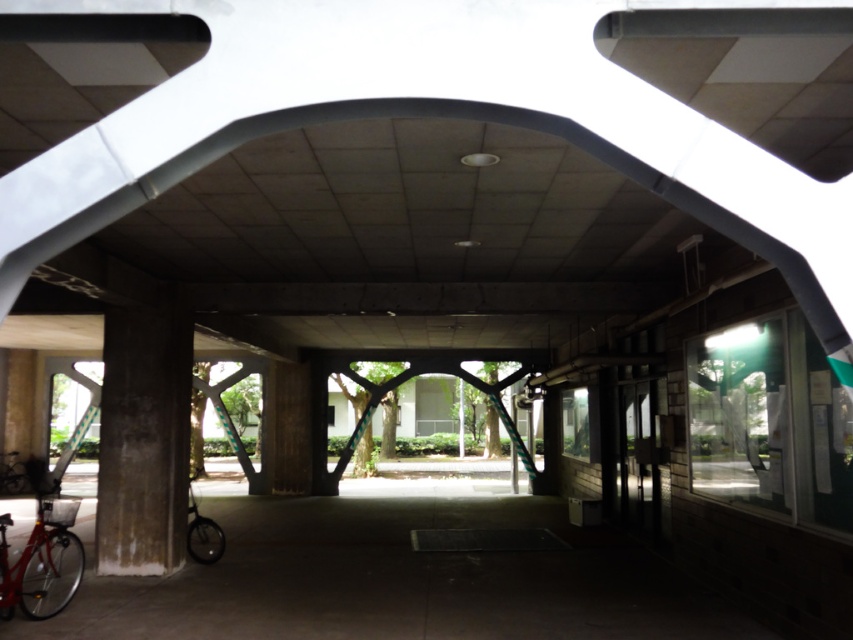
Can you confirm if shiny red bicycle at lower left is positioned below shiny black bicycle at lower left?

No.

Between shiny red bicycle at lower left and shiny black bicycle at lower left, which one appears on the right side from the viewer's perspective?

shiny black bicycle at lower left

Where is `shiny red bicycle at lower left`? Image resolution: width=853 pixels, height=640 pixels. shiny red bicycle at lower left is located at coordinates (42, 563).

Who is shorter, shiny red bicycle at lower left or matte red bicycle at lower left?

matte red bicycle at lower left is shorter.

Does point (68, 540) lie behind point (0, 456)?

No, it is not.

I want to click on shiny red bicycle at lower left, so click(42, 563).

Between shiny black bicycle at lower left and matte red bicycle at lower left, which one has less height?

shiny black bicycle at lower left

Is shiny black bicycle at lower left positioned at the back of matte red bicycle at lower left?

That is False.

You are a GUI agent. You are given a task and a screenshot of the screen. Output one action in this format:
    pyautogui.click(x=<x>, y=<y>)
    Task: Click on the shiny black bicycle at lower left
    
    Given the screenshot: What is the action you would take?
    pyautogui.click(x=202, y=532)